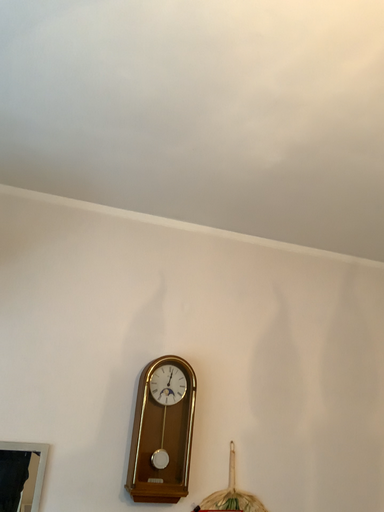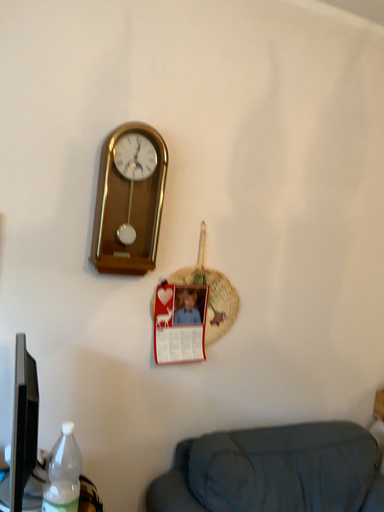
Question: How did the camera likely rotate when shooting the video?

Choices:
 (A) rotated downward
 (B) rotated upward

Answer: (A)